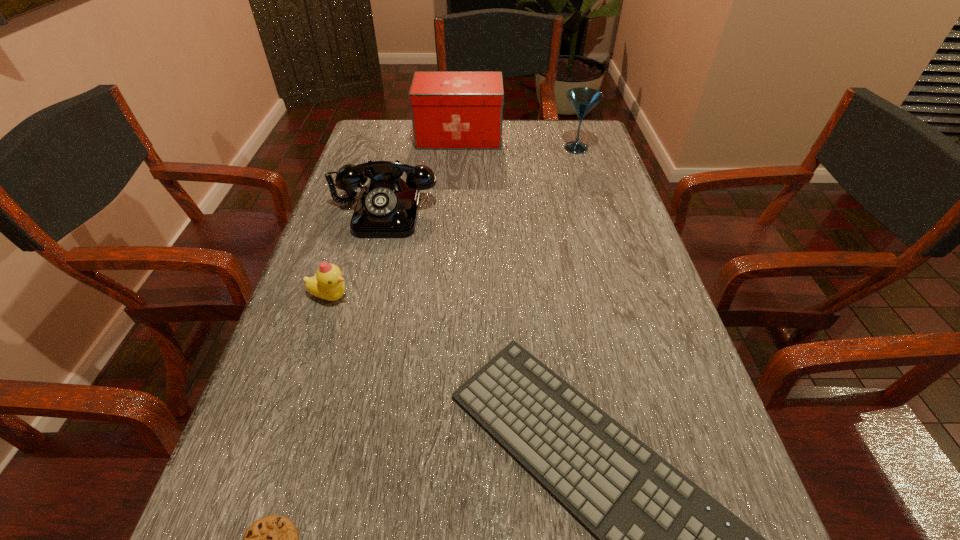
In order to click on the first-aid kit in this screenshot , I will do `click(450, 110)`.

This screenshot has height=540, width=960. Find the location of `martini`. martini is located at coordinates (583, 100).

The width and height of the screenshot is (960, 540). I want to click on the fourth shortest object, so click(x=387, y=207).

Where is `telephone`? telephone is located at coordinates (387, 207).

Image resolution: width=960 pixels, height=540 pixels. Find the location of `the third shortest object`. the third shortest object is located at coordinates (327, 284).

Image resolution: width=960 pixels, height=540 pixels. What are the coordinates of `the fourth farthest object` in the screenshot? It's located at (327, 284).

The width and height of the screenshot is (960, 540). I want to click on vacant area situated on the handle side of the first-aid kit, so click(535, 137).

Locate an element on the screen. The width and height of the screenshot is (960, 540). blank space located on the front of the martini is located at coordinates (582, 168).

Where is `vacant space located on the dial of the fourth shortest object`? This screenshot has width=960, height=540. vacant space located on the dial of the fourth shortest object is located at coordinates (359, 309).

The height and width of the screenshot is (540, 960). In order to click on vacant position located on the front-facing side of the third nearest object in this screenshot , I will do `click(440, 296)`.